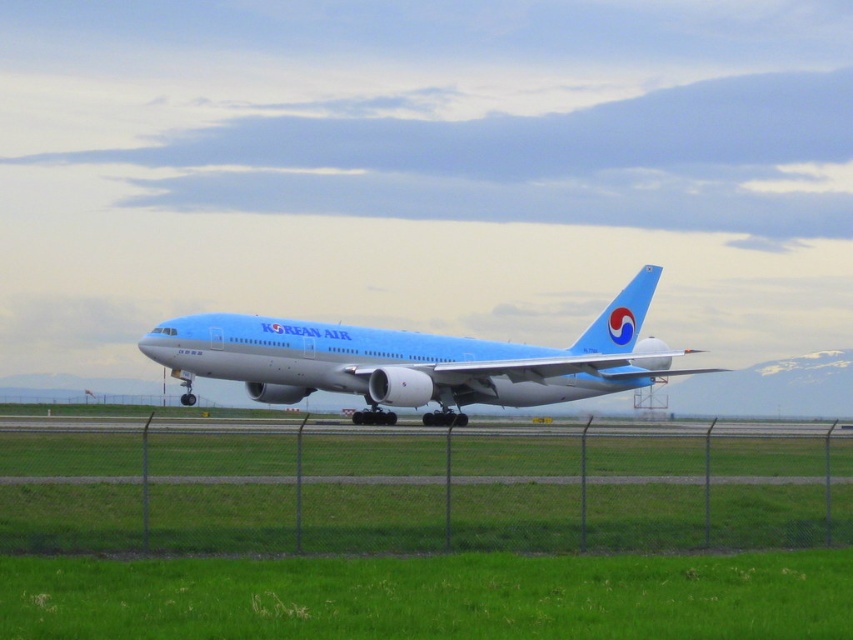
Question: Which object appears closest to the camera in this image?

Choices:
 (A) green grass at lower center
 (B) light blue matte airplane at center
 (C) metallic chain-link fence at lower center

Answer: (A)

Question: Can you confirm if green grass at lower center is thinner than light blue matte airplane at center?

Choices:
 (A) yes
 (B) no

Answer: (A)

Question: Can you confirm if metallic chain-link fence at lower center is positioned below green grass at lower center?

Choices:
 (A) no
 (B) yes

Answer: (B)

Question: Is metallic chain-link fence at lower center wider than light blue matte airplane at center?

Choices:
 (A) yes
 (B) no

Answer: (B)

Question: Which object is the closest to the metallic chain-link fence at lower center?

Choices:
 (A) green grass at lower center
 (B) light blue matte airplane at center

Answer: (A)

Question: Estimate the real-world distances between objects in this image. Which object is farther from the green grass at lower center?

Choices:
 (A) light blue matte airplane at center
 (B) metallic chain-link fence at lower center

Answer: (A)